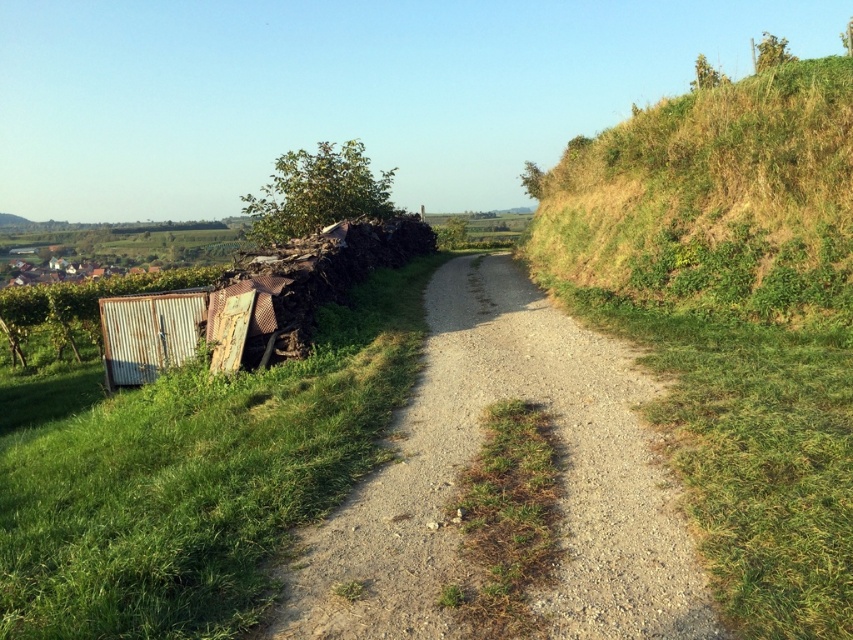
Is green corrugated metal at left shorter than gravelly dirt path at center?

No, green corrugated metal at left is not shorter than gravelly dirt path at center.

Is green corrugated metal at left positioned at the back of gravelly dirt path at center?

Yes, it is.

Measure the distance between green corrugated metal at left and camera.

A distance of 10.43 feet exists between green corrugated metal at left and camera.

Where is `green corrugated metal at left`? This screenshot has width=853, height=640. green corrugated metal at left is located at coordinates (192, 476).

Who is taller, gravelly dirt path at center or green grassy hillside at upper right?

green grassy hillside at upper right

The image size is (853, 640). I want to click on gravelly dirt path at center, so click(473, 458).

The width and height of the screenshot is (853, 640). What do you see at coordinates (473, 458) in the screenshot?
I see `gravelly dirt path at center` at bounding box center [473, 458].

What are the coordinates of `gravelly dirt path at center` in the screenshot? It's located at (473, 458).

Which is more to the right, green corrugated metal at left or green grassy hillside at upper right?

green grassy hillside at upper right is more to the right.

This screenshot has height=640, width=853. What do you see at coordinates (192, 476) in the screenshot?
I see `green corrugated metal at left` at bounding box center [192, 476].

In order to click on green corrugated metal at left in this screenshot , I will do `click(192, 476)`.

Where is `green corrugated metal at left`? green corrugated metal at left is located at coordinates (192, 476).